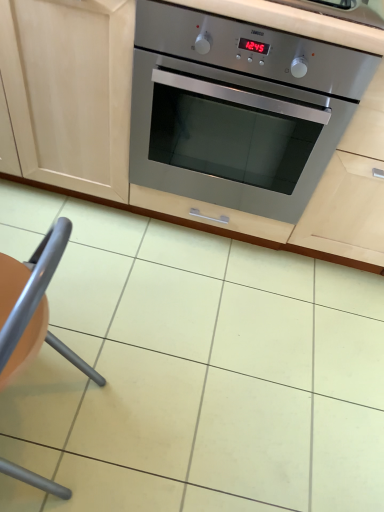
Question: In terms of height, does orange plastic chair at lower left look taller or shorter compared to stainless steel oven at center?

Choices:
 (A) short
 (B) tall

Answer: (A)

Question: From a real-world perspective, relative to stainless steel oven at center, is orange plastic chair at lower left vertically above or below?

Choices:
 (A) below
 (B) above

Answer: (A)

Question: From the image's perspective, relative to stainless steel oven at center, is orange plastic chair at lower left above or below?

Choices:
 (A) above
 (B) below

Answer: (B)

Question: From a real-world perspective, is stainless steel oven at center positioned above or below orange plastic chair at lower left?

Choices:
 (A) above
 (B) below

Answer: (A)

Question: From the image's perspective, is stainless steel oven at center positioned above or below orange plastic chair at lower left?

Choices:
 (A) above
 (B) below

Answer: (A)

Question: Considering the positions of stainless steel oven at center and orange plastic chair at lower left in the image, is stainless steel oven at center wider or thinner than orange plastic chair at lower left?

Choices:
 (A) thin
 (B) wide

Answer: (B)

Question: Would you say stainless steel oven at center is inside or outside orange plastic chair at lower left?

Choices:
 (A) outside
 (B) inside

Answer: (A)